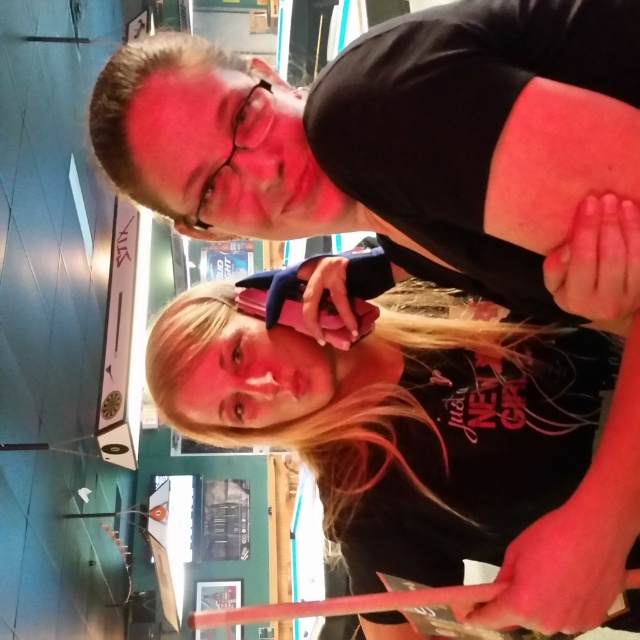
From the picture: You are a photographer trying to capture a candid shot of the two people in the image. The matte black phone at upper center and dark brown hair at upper center are both in the frame. Which object is taller in the photo?

The matte black phone at upper center is taller than the dark brown hair at upper center.

Looking at this image, you are at a social event and see two people in the image. One holds a matte black phone at upper center, and the other holds a black matte phone at center. Which phone is positioned to the left?

The matte black phone at upper center is to the left of the black matte phone at center.